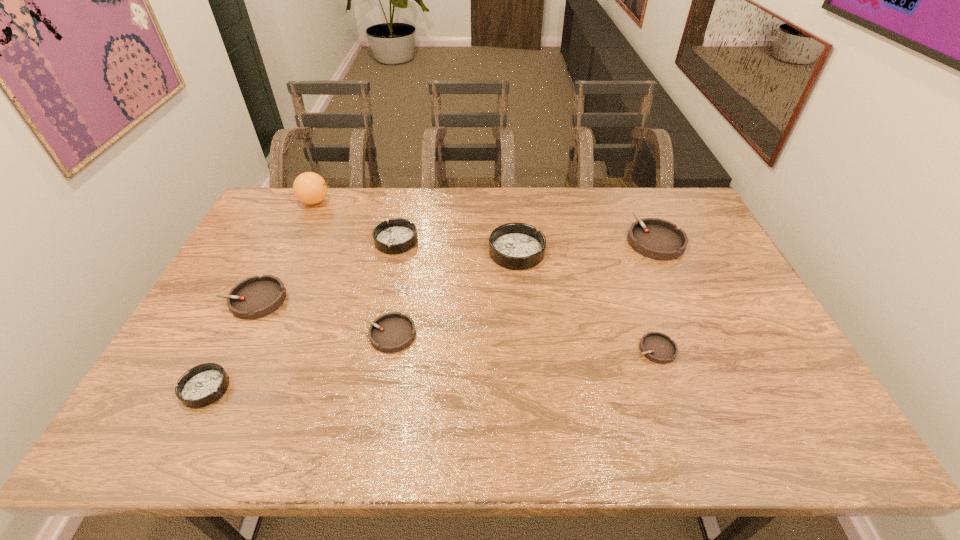
Find the location of `ping-pong ball situated at the far edge`. ping-pong ball situated at the far edge is located at coordinates (310, 188).

Where is `ashtray that is at the far edge`? The height and width of the screenshot is (540, 960). ashtray that is at the far edge is located at coordinates (654, 238).

Locate an element on the screen. The height and width of the screenshot is (540, 960). ping-pong ball at the left edge is located at coordinates (310, 188).

Identify the location of object at the right edge. (654, 238).

What are the coordinates of `object that is positioned at the far left corner` in the screenshot? It's located at (310, 188).

Find the location of a particular element. The height and width of the screenshot is (540, 960). object that is at the far right corner is located at coordinates (654, 238).

This screenshot has height=540, width=960. In the image, there is a desktop. What are the coordinates of `vacant space at the far edge` in the screenshot? It's located at (545, 192).

The height and width of the screenshot is (540, 960). Identify the location of vacant space at the near edge of the desktop. (269, 442).

Identify the location of free spot at the left edge of the desktop. The height and width of the screenshot is (540, 960). (209, 332).

Find the location of a particular element. The height and width of the screenshot is (540, 960). blank space at the right edge of the desktop is located at coordinates (716, 264).